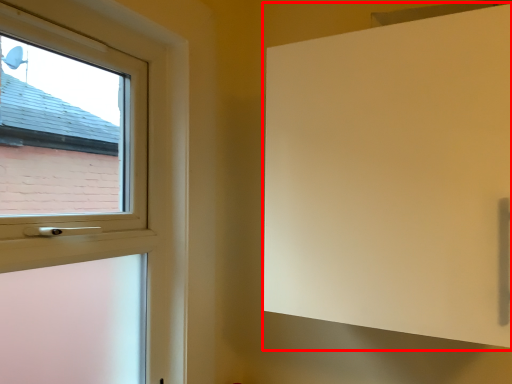
Question: In this image, where is screen door (annotated by the red box) located relative to window?

Choices:
 (A) left
 (B) right

Answer: (B)